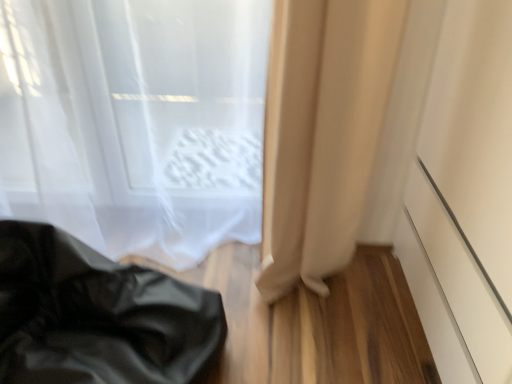
Locate an element on the screen. Image resolution: width=512 pixels, height=384 pixels. black leather bag at lower left is located at coordinates (97, 315).

What is the approximate width of white matte screen door at right?

white matte screen door at right is 54.81 centimeters wide.

At what (x,y) coordinates should I click in order to perform the action: click on beige fabric curtain at lower right, which is counted as the second curtain, starting from the left. Please return your answer as a coordinate pair (x, y). This screenshot has height=384, width=512. Looking at the image, I should click on tap(322, 132).

Considering the points (336, 3) and (262, 45), which point is behind, point (336, 3) or point (262, 45)?

Positioned behind is point (262, 45).

Image resolution: width=512 pixels, height=384 pixels. Find the location of `curtain in front of the translucent fabric curtain at upper left, which is counted as the 2th curtain, starting from the right`. curtain in front of the translucent fabric curtain at upper left, which is counted as the 2th curtain, starting from the right is located at coordinates (322, 132).

Is beige fabric curtain at lower right, which is counted as the second curtain, starting from the left, next to translucent fabric curtain at upper left, which is counted as the 2th curtain, starting from the right, and touching it?

There is a gap between beige fabric curtain at lower right, which is counted as the second curtain, starting from the left, and translucent fabric curtain at upper left, which is counted as the 2th curtain, starting from the right.

From their relative heights in the image, would you say black leather bag at lower left is taller or shorter than beige fabric curtain at lower right, positioned as the 1th curtain in right-to-left order?

Clearly, black leather bag at lower left is shorter compared to beige fabric curtain at lower right, positioned as the 1th curtain in right-to-left order.

Are black leather bag at lower left and beige fabric curtain at lower right, which is counted as the second curtain, starting from the left, beside each other?

No, black leather bag at lower left is not in contact with beige fabric curtain at lower right, which is counted as the second curtain, starting from the left.

Where is `furniture in front of the beige fabric curtain at lower right, which is counted as the second curtain, starting from the left`? furniture in front of the beige fabric curtain at lower right, which is counted as the second curtain, starting from the left is located at coordinates (97, 315).

Does black leather bag at lower left appear on the right side of beige fabric curtain at lower right, which is counted as the second curtain, starting from the left?

No, black leather bag at lower left is not to the right of beige fabric curtain at lower right, which is counted as the second curtain, starting from the left.

In terms of size, does white matte screen door at right appear bigger or smaller than translucent fabric curtain at upper left, the 1th curtain positioned from the left?

Clearly, white matte screen door at right is larger in size than translucent fabric curtain at upper left, the 1th curtain positioned from the left.

From a real-world perspective, between white matte screen door at right and translucent fabric curtain at upper left, the 1th curtain positioned from the left, who is vertically higher?

white matte screen door at right, from a real-world perspective.

Considering the relative sizes of white matte screen door at right and translucent fabric curtain at upper left, the 1th curtain positioned from the left, in the image provided, is white matte screen door at right shorter than translucent fabric curtain at upper left, the 1th curtain positioned from the left,?

In fact, white matte screen door at right may be taller than translucent fabric curtain at upper left, the 1th curtain positioned from the left.

From the picture: How distant is white matte screen door at right from translucent fabric curtain at upper left, which is counted as the 2th curtain, starting from the right?

white matte screen door at right and translucent fabric curtain at upper left, which is counted as the 2th curtain, starting from the right, are 35.96 inches apart.

Can you confirm if translucent fabric curtain at upper left, the 1th curtain positioned from the left, is positioned to the left of black leather bag at lower left?

No.

How different are the orientations of translucent fabric curtain at upper left, the 1th curtain positioned from the left, and black leather bag at lower left in degrees?

89.5 degrees separate the facing orientations of translucent fabric curtain at upper left, the 1th curtain positioned from the left, and black leather bag at lower left.

Considering the relative sizes of translucent fabric curtain at upper left, which is counted as the 2th curtain, starting from the right, and black leather bag at lower left in the image provided, is translucent fabric curtain at upper left, which is counted as the 2th curtain, starting from the right, shorter than black leather bag at lower left?

No, translucent fabric curtain at upper left, which is counted as the 2th curtain, starting from the right, is not shorter than black leather bag at lower left.

Considering the positions of points (93, 279) and (157, 61), is point (93, 279) farther from camera compared to point (157, 61)?

No, (93, 279) is in front of (157, 61).

From a real-world perspective, which object stands above the other?

From a 3D spatial view, translucent fabric curtain at upper left, the 1th curtain positioned from the left, is above.

From the image's perspective, which is below, black leather bag at lower left or translucent fabric curtain at upper left, the 1th curtain positioned from the left?

black leather bag at lower left.

Based on the photo, how different are the orientations of black leather bag at lower left and translucent fabric curtain at upper left, the 1th curtain positioned from the left, in degrees?

89.5 degrees.

Is black leather bag at lower left surrounding white matte screen door at right?

No, white matte screen door at right is located outside of black leather bag at lower left.

From the image's perspective, is black leather bag at lower left under white matte screen door at right?

Yes, from the image's perspective, black leather bag at lower left is below white matte screen door at right.

Which is in front, point (111, 371) or point (439, 160)?

Positioned in front is point (111, 371).

Could you measure the distance between translucent fabric curtain at upper left, the 1th curtain positioned from the left, and beige fabric curtain at lower right, positioned as the 1th curtain in right-to-left order?

They are 17.19 inches apart.

In the image, is translucent fabric curtain at upper left, which is counted as the 2th curtain, starting from the right, on the left side or the right side of beige fabric curtain at lower right, positioned as the 1th curtain in right-to-left order?

Clearly, translucent fabric curtain at upper left, which is counted as the 2th curtain, starting from the right, is on the left of beige fabric curtain at lower right, positioned as the 1th curtain in right-to-left order, in the image.

Which point is more forward, [209,78] or [329,211]?

Positioned in front is point [209,78].

Is translucent fabric curtain at upper left, the 1th curtain positioned from the left, touching beige fabric curtain at lower right, positioned as the 1th curtain in right-to-left order?

No, translucent fabric curtain at upper left, the 1th curtain positioned from the left, is not with beige fabric curtain at lower right, positioned as the 1th curtain in right-to-left order.

Image resolution: width=512 pixels, height=384 pixels. There is a translucent fabric curtain at upper left, which is counted as the 2th curtain, starting from the right. Identify the location of curtain above it (from a real-world perspective). (322, 132).

This screenshot has height=384, width=512. What are the coordinates of `furniture in front of the beige fabric curtain at lower right, which is counted as the second curtain, starting from the left` in the screenshot? It's located at (97, 315).

Based on their spatial positions, is translucent fabric curtain at upper left, which is counted as the 2th curtain, starting from the right, or beige fabric curtain at lower right, positioned as the 1th curtain in right-to-left order, further from white matte screen door at right?

The object further to white matte screen door at right is translucent fabric curtain at upper left, which is counted as the 2th curtain, starting from the right.

Considering their positions, is black leather bag at lower left positioned further to white matte screen door at right than beige fabric curtain at lower right, which is counted as the second curtain, starting from the left?

Based on the image, black leather bag at lower left appears to be further to white matte screen door at right.

Estimate the real-world distances between objects in this image. Which object is closer to black leather bag at lower left, white matte screen door at right or beige fabric curtain at lower right, positioned as the 1th curtain in right-to-left order?

The object closer to black leather bag at lower left is beige fabric curtain at lower right, positioned as the 1th curtain in right-to-left order.

Based on their spatial positions, is white matte screen door at right or translucent fabric curtain at upper left, the 1th curtain positioned from the left, further from beige fabric curtain at lower right, positioned as the 1th curtain in right-to-left order?

translucent fabric curtain at upper left, the 1th curtain positioned from the left.

Looking at the image, which one is located closer to beige fabric curtain at lower right, positioned as the 1th curtain in right-to-left order, translucent fabric curtain at upper left, which is counted as the 2th curtain, starting from the right, or black leather bag at lower left?

Based on the image, translucent fabric curtain at upper left, which is counted as the 2th curtain, starting from the right, appears to be nearer to beige fabric curtain at lower right, positioned as the 1th curtain in right-to-left order.

Based on their spatial positions, is white matte screen door at right or translucent fabric curtain at upper left, the 1th curtain positioned from the left, further from black leather bag at lower left?

white matte screen door at right is positioned further to the anchor black leather bag at lower left.

Which object lies further to the anchor point translucent fabric curtain at upper left, the 1th curtain positioned from the left, white matte screen door at right or beige fabric curtain at lower right, positioned as the 1th curtain in right-to-left order?

Based on the image, white matte screen door at right appears to be further to translucent fabric curtain at upper left, the 1th curtain positioned from the left.

Estimate the real-world distances between objects in this image. Which object is further from translucent fabric curtain at upper left, the 1th curtain positioned from the left, black leather bag at lower left or beige fabric curtain at lower right, which is counted as the second curtain, starting from the left?

black leather bag at lower left is further to translucent fabric curtain at upper left, the 1th curtain positioned from the left.

Find the location of `curtain located between translucent fabric curtain at upper left, the 1th curtain positioned from the left, and white matte screen door at right in the left-right direction`. curtain located between translucent fabric curtain at upper left, the 1th curtain positioned from the left, and white matte screen door at right in the left-right direction is located at coordinates (322, 132).

I want to click on curtain between black leather bag at lower left and beige fabric curtain at lower right, which is counted as the second curtain, starting from the left, so click(x=135, y=121).